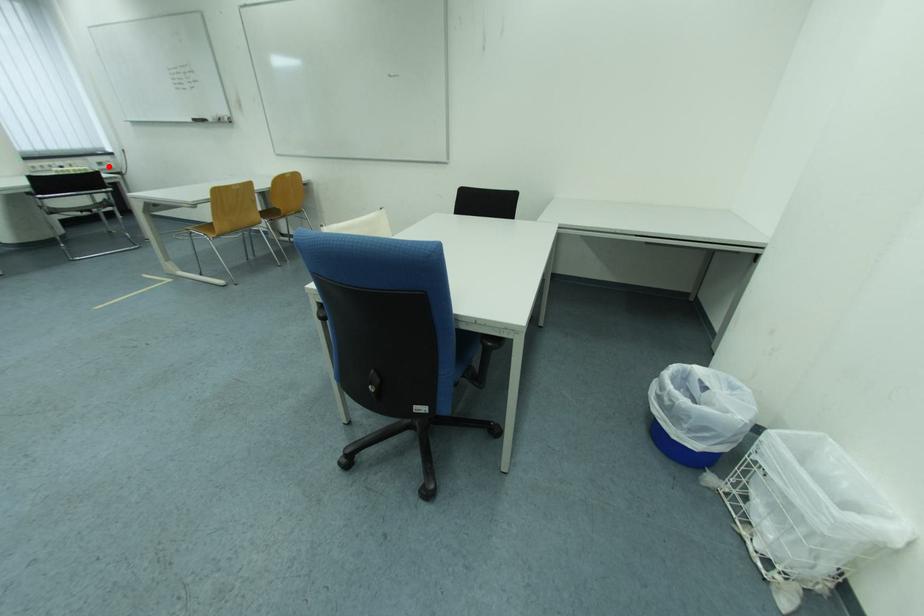
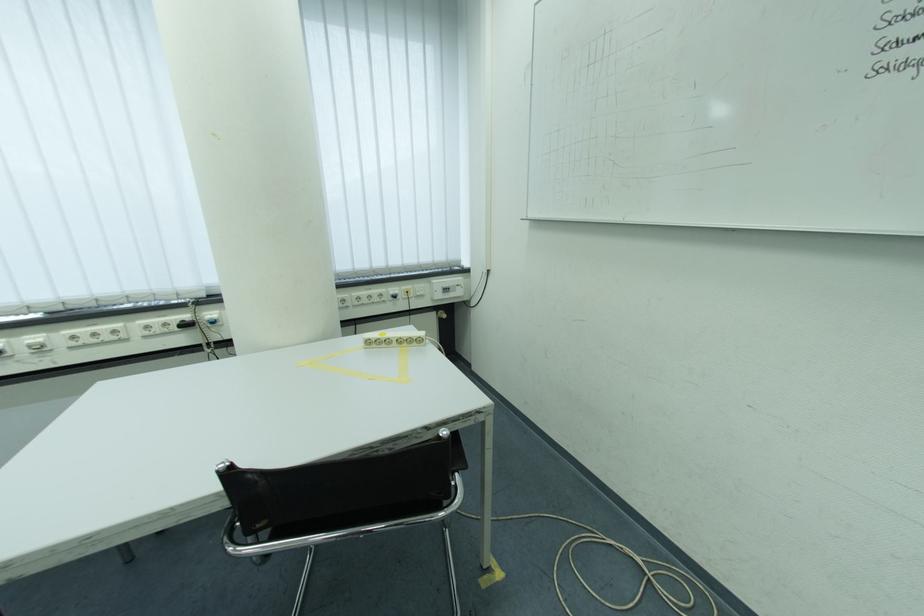
Find the pixel in the second image that matches the highlighted location in the first image.

(455, 292)